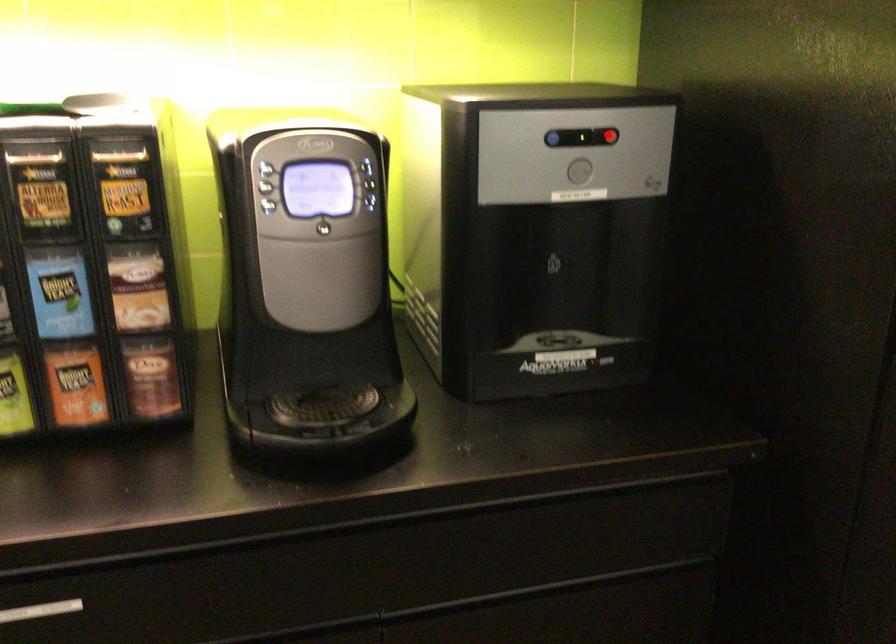
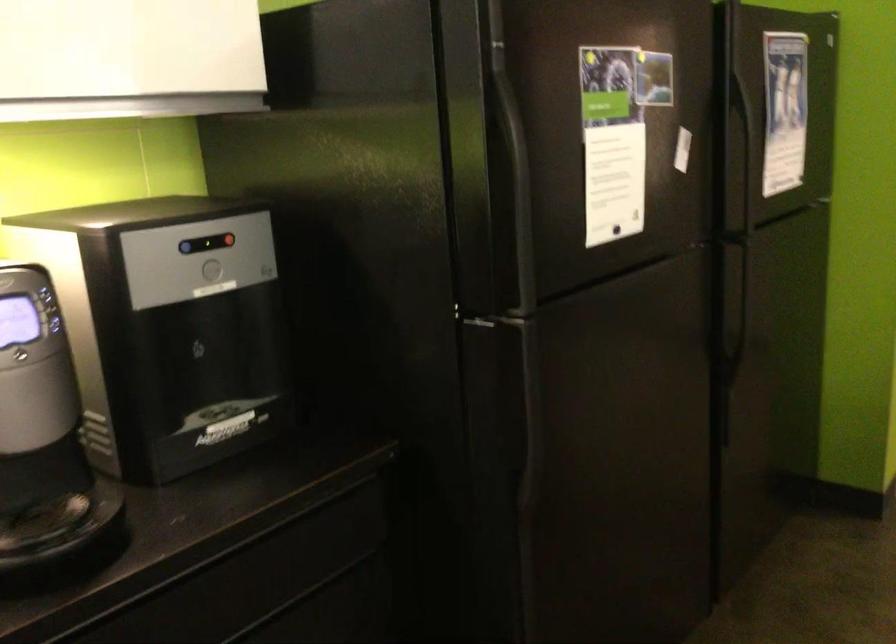
Question: A red point is marked in image1. In image2, is the corresponding 3D point closer to the camera or farther? Reply with the corresponding letter.

Choices:
 (A) The corresponding 3D point is closer.
 (B) The corresponding 3D point is farther.

Answer: (B)